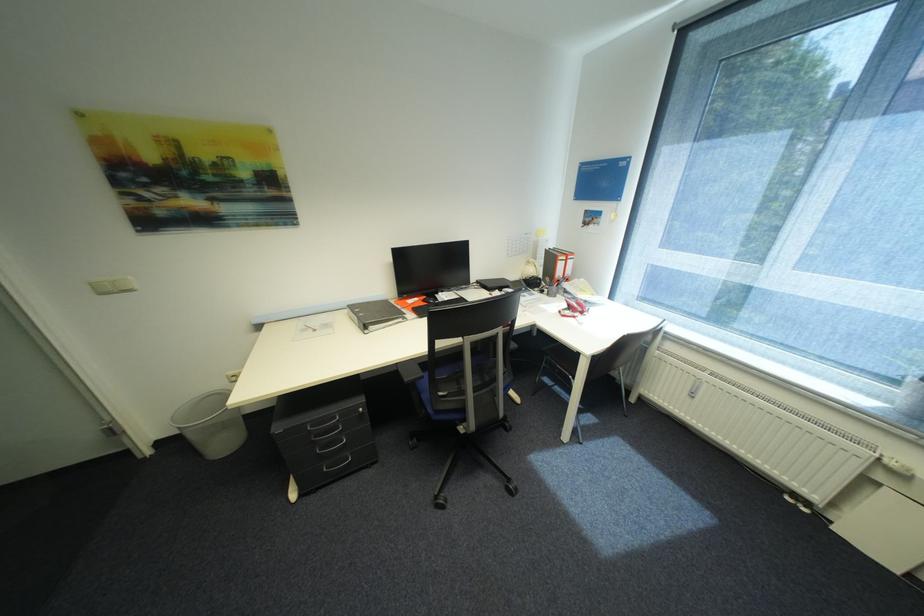
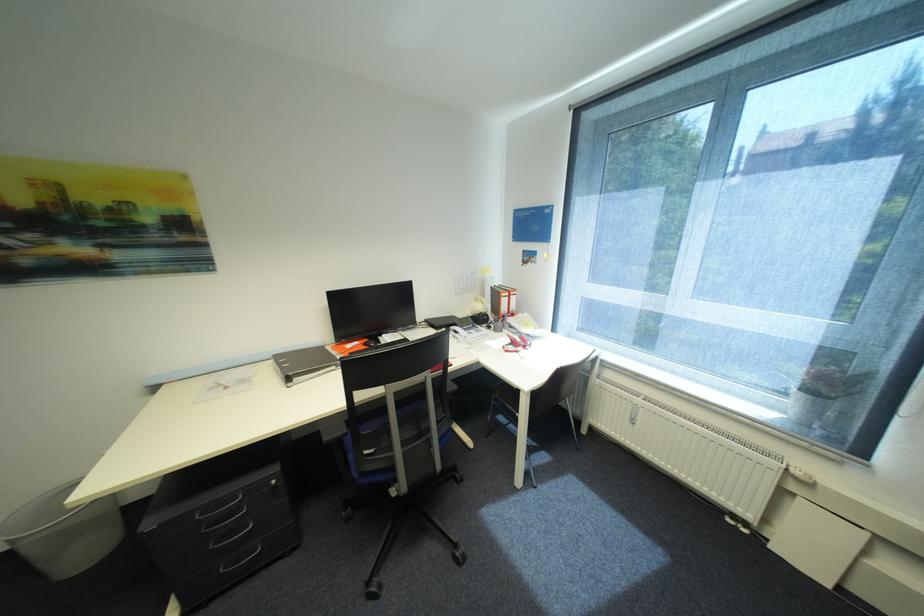
The point at [600,227] is marked in the first image. Where is the corresponding point in the second image?

(537, 265)